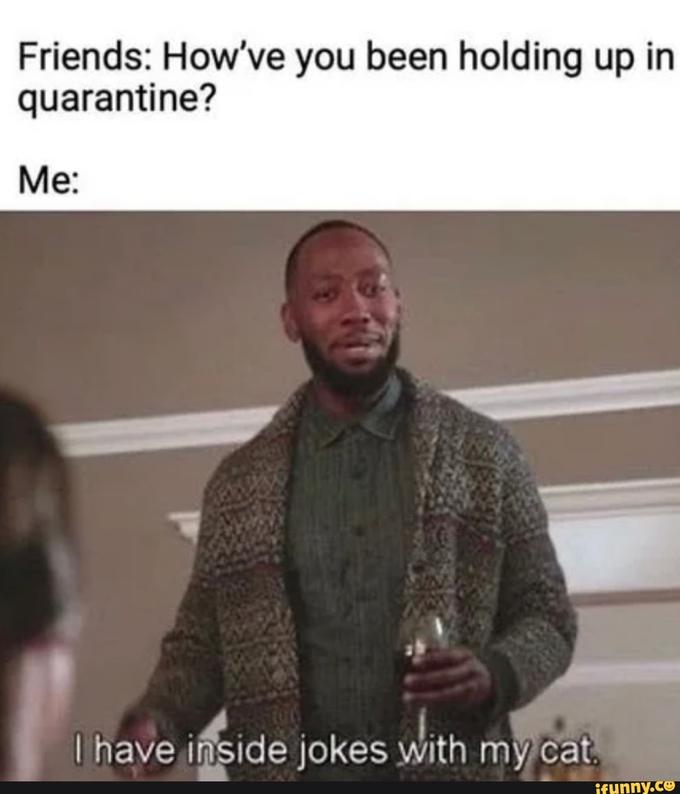
At what (x,y) coordinates should I click in order to perform the action: click on thick white trim piece. Please return your answer as a coordinate pair (x, y). The width and height of the screenshot is (680, 794). Looking at the image, I should click on (653, 532), (188, 515).